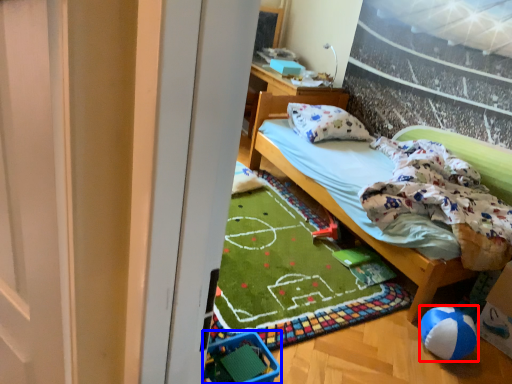
Question: Which of the following is the closest to the observer, ball (highlighted by a red box) or baby carriage (highlighted by a blue box)?

Choices:
 (A) ball
 (B) baby carriage

Answer: (B)